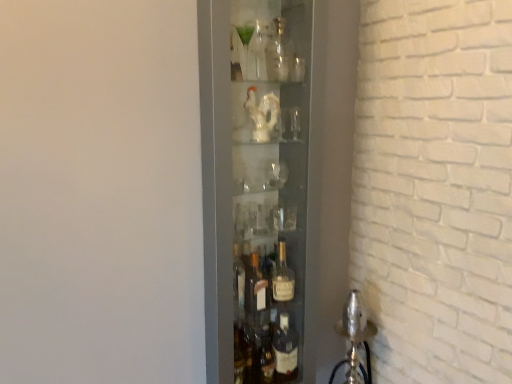
Locate an element on the screen. clear glass bottle at upper center, the 1th bottle when ordered from top to bottom is located at coordinates (279, 54).

The image size is (512, 384). Find the location of `clear glass bottle at center, which is the second bottle from bottom to top`. clear glass bottle at center, which is the second bottle from bottom to top is located at coordinates (257, 52).

How different are the orientations of clear glass bottle at center, which is the first bottle from front to back, and translucent glass bottle at center, the 3th bottle positioned from the top, in degrees?

The facing directions of clear glass bottle at center, which is the first bottle from front to back, and translucent glass bottle at center, the 3th bottle positioned from the top, are 0.00259 degrees apart.

Which object is closer to the camera taking this photo, clear glass bottle at center, which is the first bottle from front to back, or translucent glass bottle at center, the 3th bottle positioned from the top?

clear glass bottle at center, which is the first bottle from front to back, is in front.

How much distance is there between clear glass bottle at center, which is counted as the third bottle, starting from the back, and translucent glass bottle at center, the 3th bottle positioned from the top?

clear glass bottle at center, which is counted as the third bottle, starting from the back, is 72.04 centimeters away from translucent glass bottle at center, the 3th bottle positioned from the top.

From the image's perspective, between clear glass bottle at center, which is the first bottle from front to back, and translucent glass bottle at center, the 3th bottle positioned from the top, who is located below?

From the image's view, translucent glass bottle at center, the 3th bottle positioned from the top, is below.

You are a GUI agent. You are given a task and a screenshot of the screen. Output one action in this format:
    pyautogui.click(x=<x>, y=<y>)
    Task: Click on the bottle below the clear glass shot glass at upper center (from a real-world perspective)
    The width and height of the screenshot is (512, 384).
    Given the screenshot: What is the action you would take?
    pyautogui.click(x=282, y=277)

Is translucent glass bottle at center, acting as the first bottle starting from the back, taller or shorter than clear glass shot glass at upper center?

In the image, translucent glass bottle at center, acting as the first bottle starting from the back, appears to be taller than clear glass shot glass at upper center.

Considering the positions of objects translucent glass bottle at center, which is the 3th bottle in front-to-back order, and clear glass shot glass at upper center in the image provided, who is more to the right, translucent glass bottle at center, which is the 3th bottle in front-to-back order, or clear glass shot glass at upper center?

clear glass shot glass at upper center is more to the right.

Is translucent glass bottle at center, the 3th bottle positioned from the top, facing towards clear glass shot glass at upper center?

No, translucent glass bottle at center, the 3th bottle positioned from the top, is not facing towards clear glass shot glass at upper center.

From a real-world perspective, is clear glass shot glass at upper center located beneath clear glass bottle at center, which is counted as the third bottle, starting from the back?

Yes, from a real-world perspective, clear glass shot glass at upper center is beneath clear glass bottle at center, which is counted as the third bottle, starting from the back.

Is point (298, 122) positioned after point (261, 35)?

Yes, it is.

From the image's perspective, is clear glass shot glass at upper center under clear glass bottle at center, which is the second bottle from bottom to top?

Indeed, from the image's perspective, clear glass shot glass at upper center is shown beneath clear glass bottle at center, which is the second bottle from bottom to top.

Is clear glass shot glass at upper center located outside clear glass bottle at center, which is the second bottle from bottom to top?

Yes, clear glass shot glass at upper center is located beyond the bounds of clear glass bottle at center, which is the second bottle from bottom to top.

Find the location of a particular element. This screenshot has width=512, height=384. shelf below the clear glass bottle at upper center, which is the 3th bottle in bottom-to-top order (from a real-world perspective) is located at coordinates (276, 186).

Is point (212, 84) positioned before point (283, 35)?

Yes.

Is transparent glass bottles at center placed right next to clear glass bottle at upper center, which is the 3th bottle in bottom-to-top order?

No, transparent glass bottles at center is not in contact with clear glass bottle at upper center, which is the 3th bottle in bottom-to-top order.

Who is shorter, transparent glass bottles at center or clear glass bottle at upper center, the 1th bottle when ordered from top to bottom?

Standing shorter between the two is clear glass bottle at upper center, the 1th bottle when ordered from top to bottom.

From the image's perspective, is clear glass shot glass at upper center over transparent glass bottles at center?

Yes, from the image's perspective, clear glass shot glass at upper center is above transparent glass bottles at center.

From a real-world perspective, is clear glass shot glass at upper center positioned under transparent glass bottles at center based on gravity?

No, from a real-world perspective, clear glass shot glass at upper center is not below transparent glass bottles at center.

Locate an element on the screen. This screenshot has width=512, height=384. bottle that is the 1st object located in front of the translucent glass bottle at center, which is the 3th bottle in front-to-back order is located at coordinates (279, 54).

Which of these two, translucent glass bottle at center, acting as the first bottle starting from the back, or clear glass bottle at upper center, the 1th bottle when ordered from top to bottom, stands shorter?

clear glass bottle at upper center, the 1th bottle when ordered from top to bottom.

Considering the relative sizes of translucent glass bottle at center, which is the 3th bottle in front-to-back order, and clear glass bottle at upper center, the second bottle positioned from the front, in the image provided, is translucent glass bottle at center, which is the 3th bottle in front-to-back order, thinner than clear glass bottle at upper center, the second bottle positioned from the front,?

Answer: In fact, translucent glass bottle at center, which is the 3th bottle in front-to-back order, might be wider than clear glass bottle at upper center, the second bottle positioned from the front.

Who is taller, clear glass bottle at center, which is counted as the third bottle, starting from the back, or clear glass bottle at upper center, the second bottle positioned from the front?

clear glass bottle at upper center, the second bottle positioned from the front.

Is clear glass bottle at center, which is the first bottle from front to back, to the left or to the right of clear glass bottle at upper center, the second bottle positioned from the front, in the image?

Based on their positions, clear glass bottle at center, which is the first bottle from front to back, is located to the left of clear glass bottle at upper center, the second bottle positioned from the front.

Is clear glass bottle at center, which is counted as the third bottle, starting from the back, next to clear glass bottle at upper center, acting as the 2th bottle starting from the back?

Yes, clear glass bottle at center, which is counted as the third bottle, starting from the back, is right next to clear glass bottle at upper center, acting as the 2th bottle starting from the back, and making contact.

From a real-world perspective, which object stands above the other?

clear glass bottle at upper center, the second bottle positioned from the front.

Where is `the 2nd bottle to the right when counting from the clear glass bottle at center, the second bottle in the top-to-bottom sequence`? This screenshot has height=384, width=512. the 2nd bottle to the right when counting from the clear glass bottle at center, the second bottle in the top-to-bottom sequence is located at coordinates (282, 277).

This screenshot has width=512, height=384. I want to click on bottle located behind the clear glass shot glass at upper center, so click(x=282, y=277).

Looking at the image, which one is located closer to clear glass bottle at center, which is counted as the third bottle, starting from the back, translucent glass bottle at center, the 3th bottle positioned from the top, or clear glass bottle at upper center, the second bottle positioned from the front?

Based on the image, clear glass bottle at upper center, the second bottle positioned from the front, appears to be nearer to clear glass bottle at center, which is counted as the third bottle, starting from the back.

Based on their spatial positions, is transparent glass bottles at center or clear glass bottle at upper center, the second bottle positioned from the front, further from translucent glass bottle at center, the 3th bottle positioned from the top?

→ Based on the image, clear glass bottle at upper center, the second bottle positioned from the front, appears to be further to translucent glass bottle at center, the 3th bottle positioned from the top.

From the image, which object appears to be farther from transparent glass bottles at center, translucent glass bottle at center, the 3th bottle positioned from the top, or clear glass bottle at upper center, the 1th bottle when ordered from top to bottom?

clear glass bottle at upper center, the 1th bottle when ordered from top to bottom, is further to transparent glass bottles at center.

From the image, which object appears to be farther from transparent glass bottles at center, clear glass bottle at center, which is the first bottle from front to back, or translucent glass bottle at center, the 3th bottle positioned from the top?

Based on the image, clear glass bottle at center, which is the first bottle from front to back, appears to be further to transparent glass bottles at center.

In the scene shown: Estimate the real-world distances between objects in this image. Which object is closer to transparent glass bottles at center, translucent glass bottle at center, which is the 1th bottle from bottom to top, or clear glass bottle at center, which is counted as the third bottle, starting from the back?

Among the two, translucent glass bottle at center, which is the 1th bottle from bottom to top, is located nearer to transparent glass bottles at center.

Based on their spatial positions, is translucent glass bottle at center, which is the 1th bottle from bottom to top, or clear glass shot glass at upper center further from clear glass bottle at upper center, which is the 3th bottle in bottom-to-top order?

translucent glass bottle at center, which is the 1th bottle from bottom to top, is positioned further to the anchor clear glass bottle at upper center, which is the 3th bottle in bottom-to-top order.

When comparing their distances from clear glass bottle at center, which is counted as the third bottle, starting from the back, does translucent glass bottle at center, the 3th bottle positioned from the top, or clear glass shot glass at upper center seem further?

The object further to clear glass bottle at center, which is counted as the third bottle, starting from the back, is translucent glass bottle at center, the 3th bottle positioned from the top.

From the picture: When comparing their distances from translucent glass bottle at center, the 3th bottle positioned from the top, does clear glass shot glass at upper center or transparent glass bottles at center seem further?

Based on the image, clear glass shot glass at upper center appears to be further to translucent glass bottle at center, the 3th bottle positioned from the top.

The image size is (512, 384). Identify the location of shelf that lies between clear glass bottle at center, which is the second bottle from bottom to top, and translucent glass bottle at center, which is the 3th bottle in front-to-back order, from top to bottom. (276, 186).

Locate an element on the screen. This screenshot has height=384, width=512. bottle between clear glass bottle at upper center, which is the 3th bottle in bottom-to-top order, and clear glass shot glass at upper center vertically is located at coordinates (257, 52).

Where is `shelf between clear glass shot glass at upper center and translucent glass bottle at center, which is the 1th bottle from bottom to top, from top to bottom`? shelf between clear glass shot glass at upper center and translucent glass bottle at center, which is the 1th bottle from bottom to top, from top to bottom is located at coordinates (276, 186).

At what (x,y) coordinates should I click in order to perform the action: click on shot glass between clear glass bottle at center, which is the first bottle from front to back, and translucent glass bottle at center, which is the 3th bottle in front-to-back order, vertically. Please return your answer as a coordinate pair (x, y). The image size is (512, 384). Looking at the image, I should click on (295, 122).